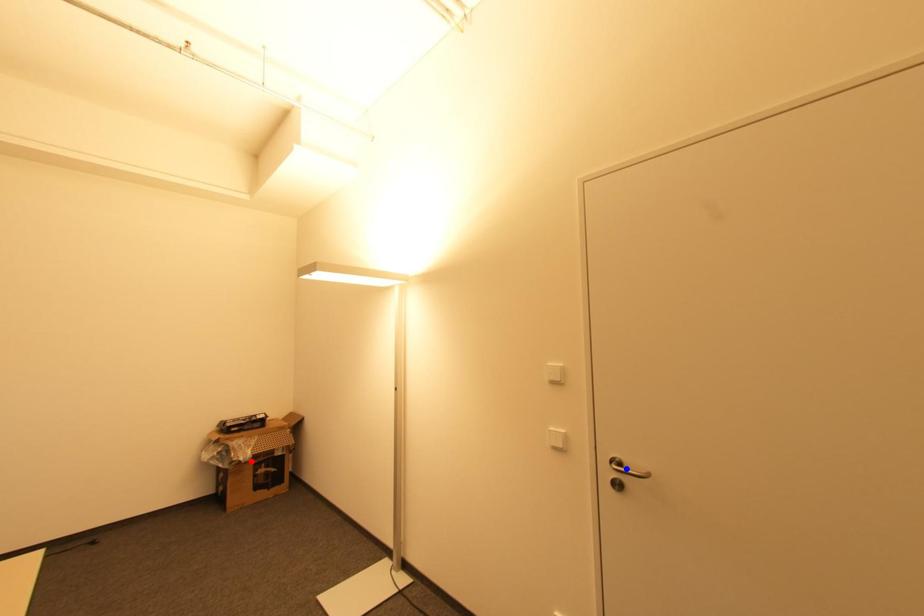
Question: Two points are marked on the image. Which point is closer to the camera?

Choices:
 (A) Blue point is closer.
 (B) Red point is closer.

Answer: (A)